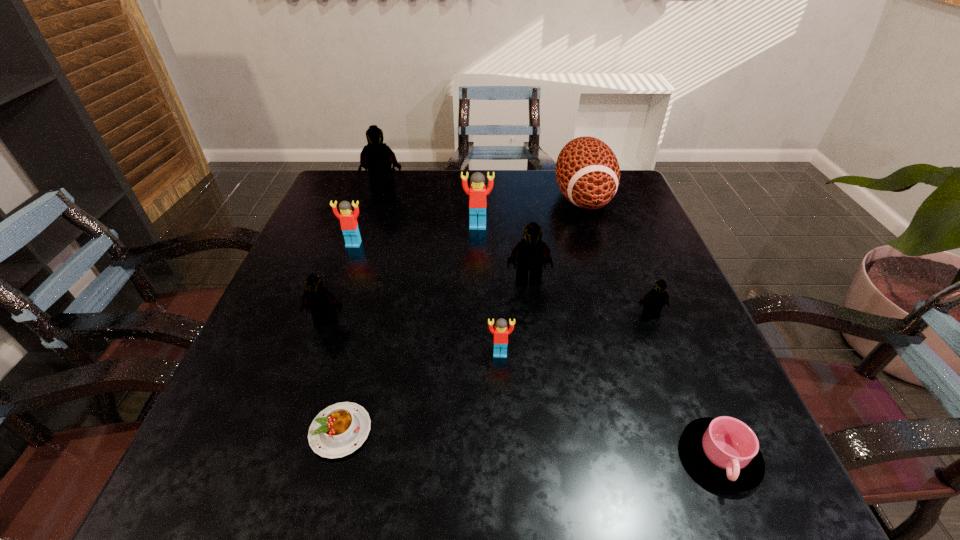
In order to click on the tallest Lego in this screenshot , I will do pyautogui.click(x=376, y=157).

The width and height of the screenshot is (960, 540). I want to click on the biggest black Lego, so click(x=376, y=157).

At what (x,y) coordinates should I click in order to perform the action: click on football. Please return your answer as a coordinate pair (x, y). The image size is (960, 540). Looking at the image, I should click on (587, 171).

Image resolution: width=960 pixels, height=540 pixels. Identify the location of the sixth nearest Lego. (477, 193).

Where is `the farthest red Lego`? The image size is (960, 540). the farthest red Lego is located at coordinates click(477, 193).

This screenshot has height=540, width=960. I want to click on the fourth nearest Lego, so click(x=531, y=253).

Identify the location of the third nearest black Lego. (531, 253).

Find the location of a particular element. This screenshot has width=960, height=540. the seventh nearest object is located at coordinates (348, 219).

You are a GUI agent. You are given a task and a screenshot of the screen. Output one action in this format:
    pyautogui.click(x=<x>, y=<y>)
    Task: Click on the second nearest red Lego
    This screenshot has height=540, width=960.
    Given the screenshot: What is the action you would take?
    pyautogui.click(x=348, y=219)

The image size is (960, 540). Identify the location of the third biggest black Lego. (317, 299).